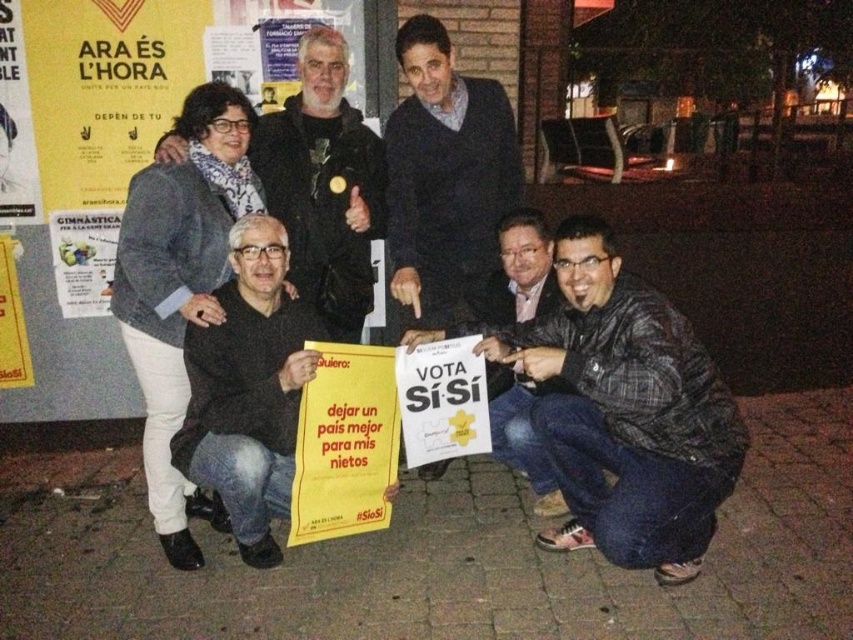
You are standing at point (538, 506) and want to walk to the exit located at point (461, 99). Is there a clear path between these two points?

Point (461, 99) is behind point (538, 506), so the path between them is blocked by the people or objects in front of point (461, 99).

You are a photographer taking a picture of the scene. You want to focus on the black matte sign at lower left and the matte black jacket at upper left. Which object is positioned closer to your camera?

The black matte sign at lower left is closer to the viewer than the matte black jacket at upper left, so the sign would be in focus first.

You are a photographer trying to capture a closeup of the black leather jacket at upper left and the matte black jacket at upper left. Which one is more to the left?

The black leather jacket at upper left is more to the left than the matte black jacket at upper left.